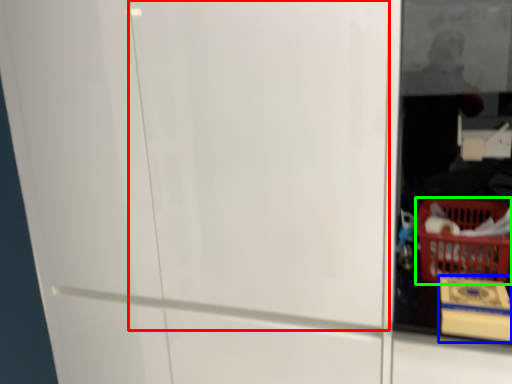
Question: Which object is the farthest from screen door (highlighted by a red box)? Choose among these: cardboard box (highlighted by a blue box) or basket (highlighted by a green box).

Choices:
 (A) cardboard box
 (B) basket

Answer: (B)